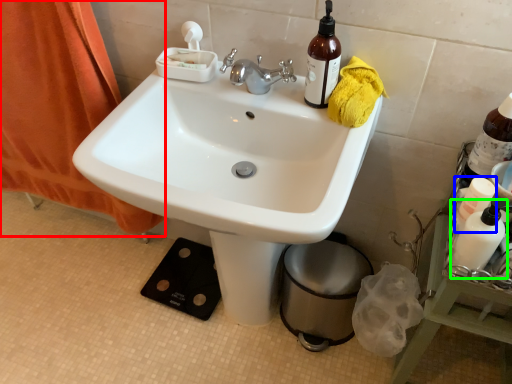
Question: Considering the real-world distances, which object is farthest from curtain (highlighted by a red box)? bottle (highlighted by a blue box) or mouthwash (highlighted by a green box)?

Choices:
 (A) bottle
 (B) mouthwash

Answer: (B)